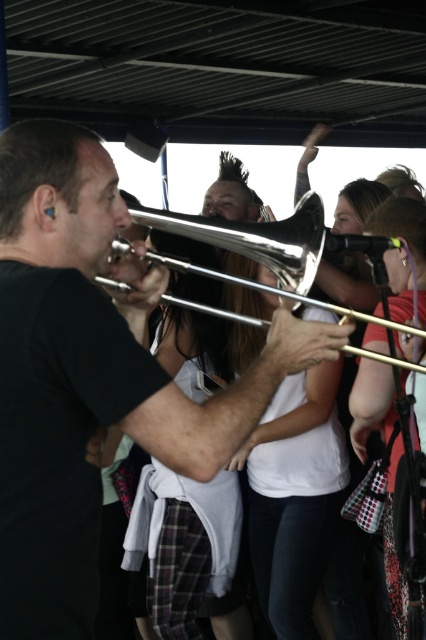
You are a photographer standing at the event. You want to take a closeup photo of the shiny silver trombone at center. Your camera has a minimum focusing distance of 1.2 meters. Will you be able to take the photo without moving closer?

The shiny silver trombone at center and viewer are 1.19 meters apart. Since the minimum focusing distance is 1.2 meters, the photographer is already closer than required. Therefore, they cannot take the closeup photo without moving back to at least 1.2 meters away.

You are a photographer at the music event. You want to take a photo that includes both the shiny silver trombone at center and the shiny silver trumpet at center. Which instrument should you position to the left side of your frame to include both?

The shiny silver trombone at center is to the left of the shiny silver trumpet at center, so to include both in the photo, position the trombone on the left side of the frame.

You are a photographer at the music event. You want to capture a closeup of the shiny silver trombone at center and shiny silver trumpet at center. Which instrument should you zoom in on first if you want to focus on the narrower one?

The shiny silver trombone at center has a lesser width compared to the shiny silver trumpet at center, so you should zoom in on the shiny silver trombone at center first to focus on the narrower one.